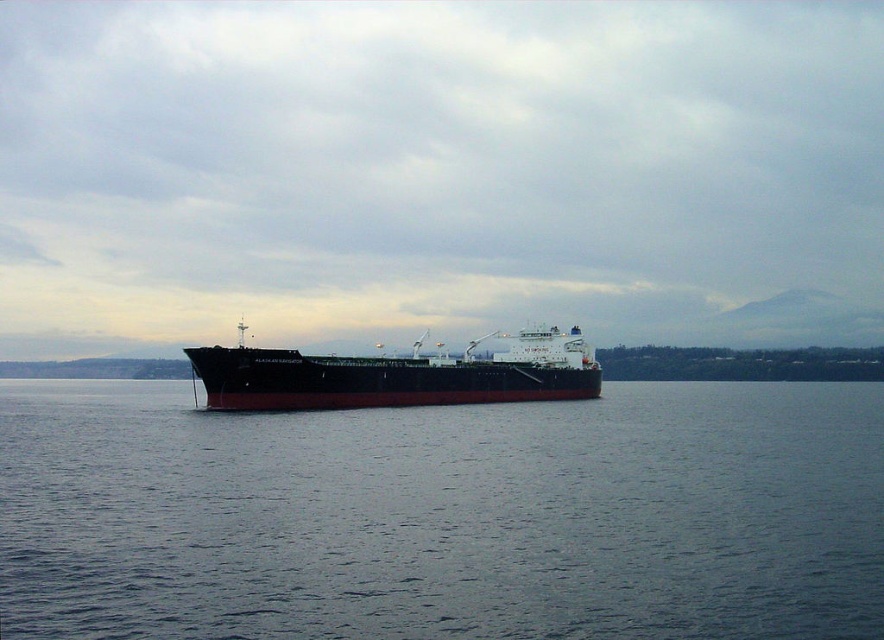
You are a sailor on the black matte ship at center. You notice the dark blue water at center. Which direction is the water in relation to the ship?

The dark blue water at center is located below the black matte ship at center, so the water is directly beneath the ship.

You are a photographer trying to capture the black matte ship at center from the shore. The dark blue water at center is wider than the ship. If you want to focus on the ship without including too much water, should you zoom in or zoom out?

The dark blue water at center is wider than the black matte ship at center, so to focus on the ship without including too much water, you should zoom in to reduce the amount of water in the frame.

You are a sailor on a small boat that is 5 meters long. You want to navigate between the dark blue water at center and the black matte ship at center. Is there enough space for your boat to pass through the gap between them?

The dark blue water at center and black matte ship at center are 18.14 meters apart from each other, so yes, your boat can pass through the gap since it is wider than the boat length of 5 meters.